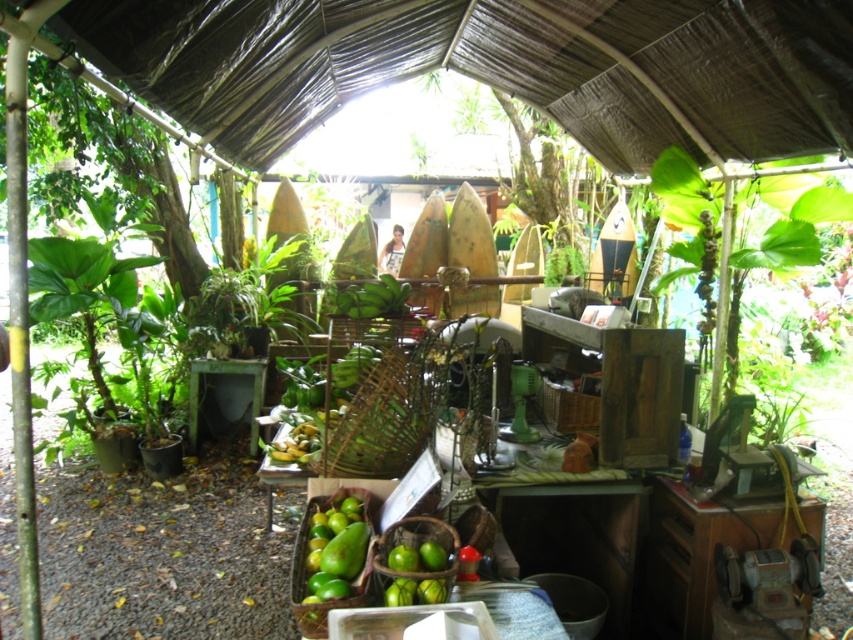
Question: Is green matte mangoes at lower center wider than green leafy plant at upper center?

Choices:
 (A) no
 (B) yes

Answer: (A)

Question: Which of the following is the farthest from the observer?

Choices:
 (A) green leafy plant at upper center
 (B) green matte mangoes at lower center

Answer: (A)

Question: Considering the relative positions of green matte mangoes at lower center and green leafy plant at upper center in the image provided, where is green matte mangoes at lower center located with respect to green leafy plant at upper center?

Choices:
 (A) left
 (B) right

Answer: (A)

Question: Is the position of green matte mangoes at lower center more distant than that of green leafy plant at upper center?

Choices:
 (A) no
 (B) yes

Answer: (A)